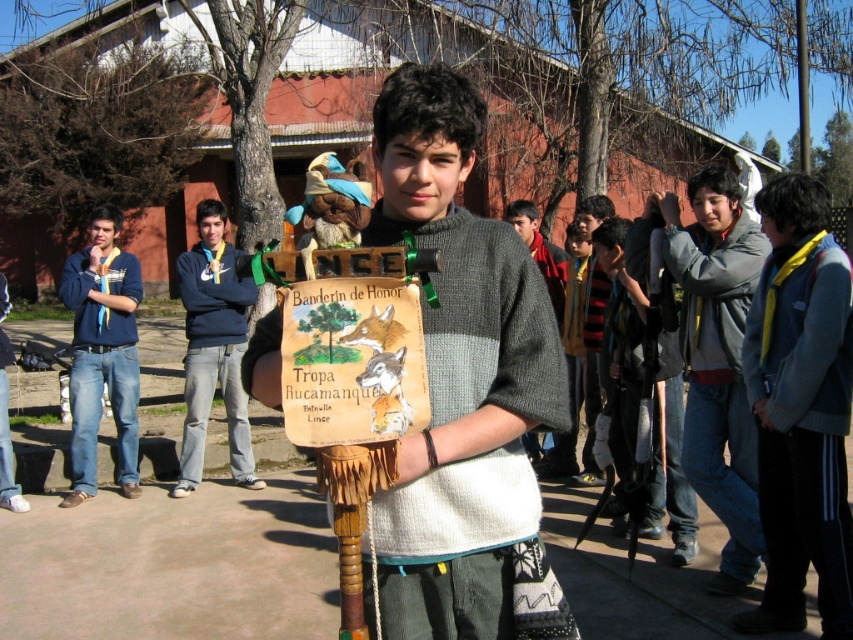
Question: Where is blue denim jeans at left located in relation to blue sweatshirt at center in the image?

Choices:
 (A) below
 (B) above

Answer: (A)

Question: Which of these objects is positioned closest to the yellow fabric scarf at right?

Choices:
 (A) gray fleece jacket at right
 (B) blue sweatshirt at center
 (C) knitted sweater at center

Answer: (A)

Question: Is knitted sweater at center bigger than yellow fabric scarf at right?

Choices:
 (A) yes
 (B) no

Answer: (B)

Question: Considering the real-world distances, which object is farthest from the yellow fabric scarf at right?

Choices:
 (A) knitted sweater at center
 (B) blue sweatshirt at center
 (C) blue denim jeans at left

Answer: (C)

Question: Estimate the real-world distances between objects in this image. Which object is closer to the blue denim jeans at left?

Choices:
 (A) knitted sweater at center
 (B) gray fleece jacket at right
 (C) yellow fabric scarf at right
 (D) blue sweatshirt at center

Answer: (D)

Question: Can you confirm if yellow fabric scarf at right is positioned to the left of blue denim jeans at left?

Choices:
 (A) yes
 (B) no

Answer: (B)